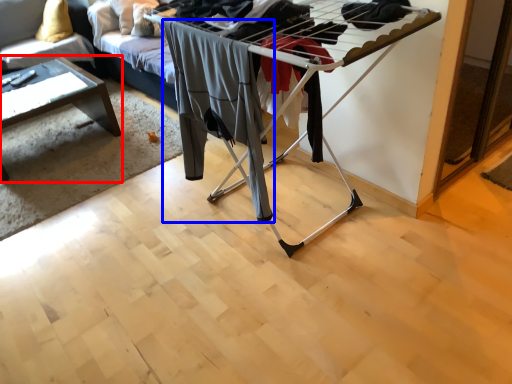
Question: Which point is further to the camera, table (highlighted by a red box) or clothing (highlighted by a blue box)?

Choices:
 (A) table
 (B) clothing

Answer: (A)